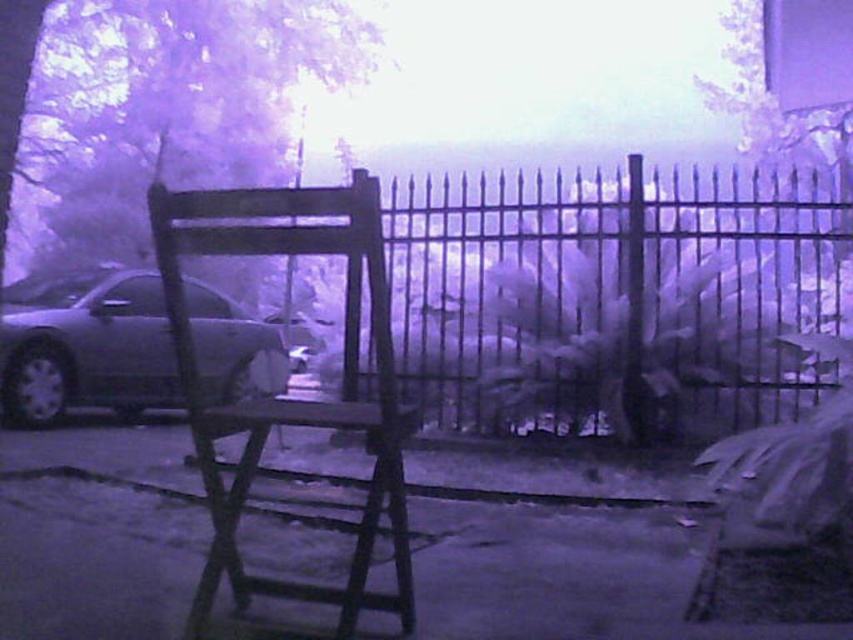
You are a delivery person who needs to park your satin silver car at left close to the purple frosted tree at upper left. Based on the scene, can you park the car so that it is taller than the tree?

The purple frosted tree at upper left has a greater height compared to the satin silver car at left. Therefore, the car cannot be parked to be taller than the tree since the tree is already taller than the car.

You are a security guard patrolling the parking lot at night. You see a purple frosted tree at upper left and a satin silver car at left. Which object is positioned more to the right side of the frame?

The purple frosted tree at upper left is positioned more to the right side of the frame compared to the satin silver car at left.